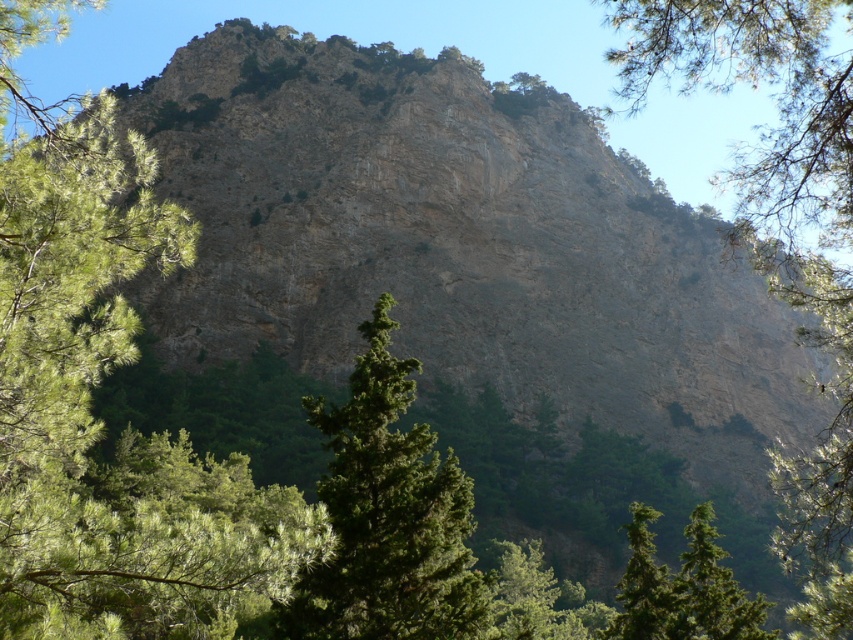
Who is positioned more to the right, green leafy tree at left or green textured tree at center?

From the viewer's perspective, green textured tree at center appears more on the right side.

Which is behind, point (16, 33) or point (422, 477)?

The point (422, 477) is behind.

Identify the location of green leafy tree at left. (90, 400).

Is green leafy tree at upper right to the right of green textured tree at center from the viewer's perspective?

Correct, you'll find green leafy tree at upper right to the right of green textured tree at center.

Is green leafy tree at upper right wider than green textured tree at center?

Yes, green leafy tree at upper right is wider than green textured tree at center.

Between point (805, 88) and point (380, 323), which one is positioned behind?

Point (380, 323)

Locate an element on the screen. green leafy tree at upper right is located at coordinates (782, 230).

Which is above, green leafy tree at left or green leafy tree at upper right?

green leafy tree at left is above.

Is green leafy tree at left positioned behind green leafy tree at upper right?

No, it is in front of green leafy tree at upper right.

Which is in front, point (111, 209) or point (834, 522)?

Point (111, 209) is in front.

Locate an element on the screen. This screenshot has width=853, height=640. green leafy tree at left is located at coordinates (90, 400).